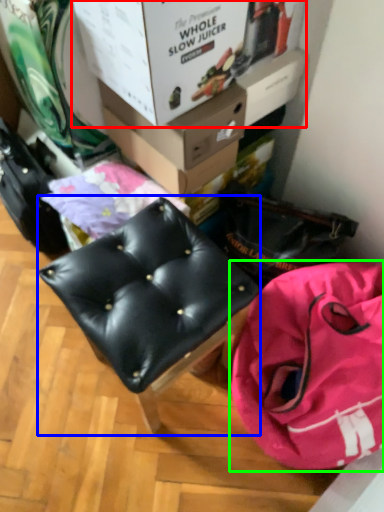
Question: Which object is the farthest from box (highlighted by a red box)? Choose among these: furniture (highlighted by a blue box) or handbag (highlighted by a green box).

Choices:
 (A) furniture
 (B) handbag

Answer: (B)